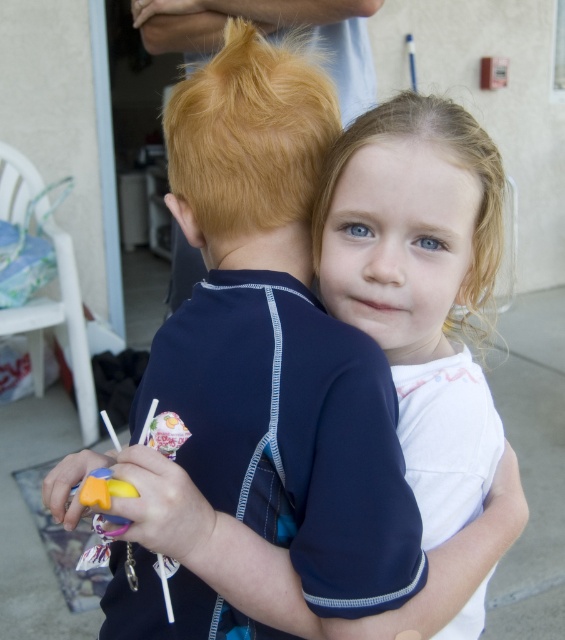
Which is behind, point (214, 122) or point (480, 316)?

The point (480, 316) is behind.

Can you confirm if dark blue fabric shirt at center is positioned above blonde curly hair at upper right?

No.

Which is behind, point (262, 532) or point (484, 177)?

The point (484, 177) is more distant.

Image resolution: width=565 pixels, height=640 pixels. I want to click on dark blue fabric shirt at center, so click(x=277, y=339).

Can you confirm if blonde shiny hair at upper center is taller than blonde curly hair at upper right?

Indeed, blonde shiny hair at upper center has a greater height compared to blonde curly hair at upper right.

Based on the photo, between blonde shiny hair at upper center and blonde curly hair at upper right, which one appears on the right side from the viewer's perspective?

From the viewer's perspective, blonde curly hair at upper right appears more on the right side.

Where is `blonde shiny hair at upper center`? blonde shiny hair at upper center is located at coordinates (249, 134).

Find the location of a particular element. blonde shiny hair at upper center is located at coordinates (249, 134).

Can you confirm if dark blue fabric shirt at center is positioned to the left of blonde shiny hair at upper center?

Yes, dark blue fabric shirt at center is to the left of blonde shiny hair at upper center.

Can you confirm if dark blue fabric shirt at center is taller than blonde shiny hair at upper center?

Yes, dark blue fabric shirt at center is taller than blonde shiny hair at upper center.

In order to click on dark blue fabric shirt at center in this screenshot , I will do `click(277, 339)`.